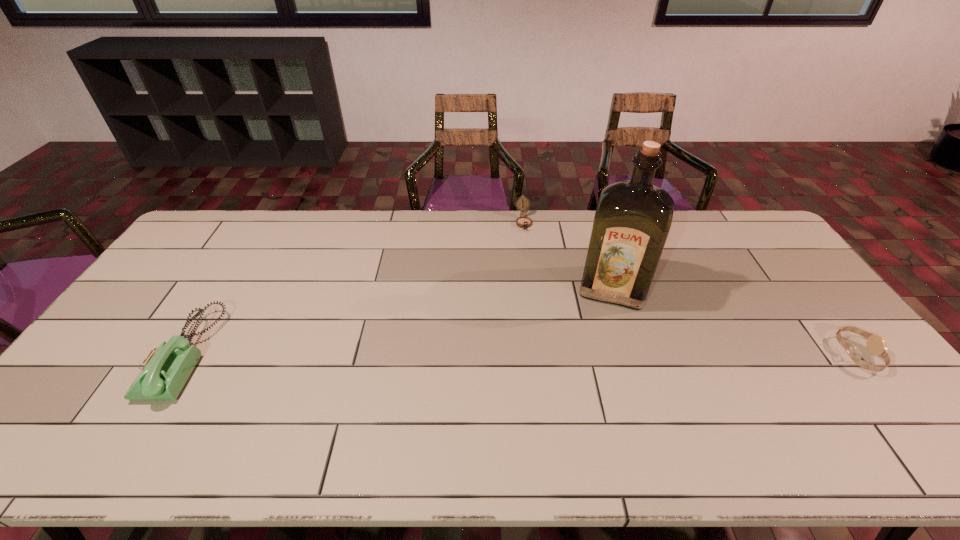
In the image, there is a desktop. At what (x,y) coordinates should I click in order to perform the action: click on vacant space at the far edge. Please return your answer as a coordinate pair (x, y). Image resolution: width=960 pixels, height=540 pixels. Looking at the image, I should click on (585, 245).

Locate an element on the screen. vacant area at the near edge of the desktop is located at coordinates [x=481, y=416].

In the image, there is a desktop. At what (x,y) coordinates should I click in order to perform the action: click on vacant space at the far left corner. Please return your answer as a coordinate pair (x, y). The image size is (960, 540). Looking at the image, I should click on (214, 235).

Where is `free spot at the near left corner of the desktop`? free spot at the near left corner of the desktop is located at coordinates (89, 411).

The width and height of the screenshot is (960, 540). In the image, there is a desktop. In order to click on vacant space at the far right corner in this screenshot , I will do `click(753, 243)`.

Locate an element on the screen. free point between the watch and the compass is located at coordinates (690, 288).

What are the coordinates of `free space between the third tallest object and the second tallest object` in the screenshot? It's located at (354, 288).

At what (x,y) coordinates should I click in order to perform the action: click on vacant space that is in between the compass and the leftmost object. Please return your answer as a coordinate pair (x, y). Image resolution: width=960 pixels, height=540 pixels. Looking at the image, I should click on (354, 288).

Where is `empty space that is in between the tallest object and the leftmost object`? The image size is (960, 540). empty space that is in between the tallest object and the leftmost object is located at coordinates (399, 321).

Where is `vacant space that is in between the farthest object and the tallest object`? Image resolution: width=960 pixels, height=540 pixels. vacant space that is in between the farthest object and the tallest object is located at coordinates (568, 255).